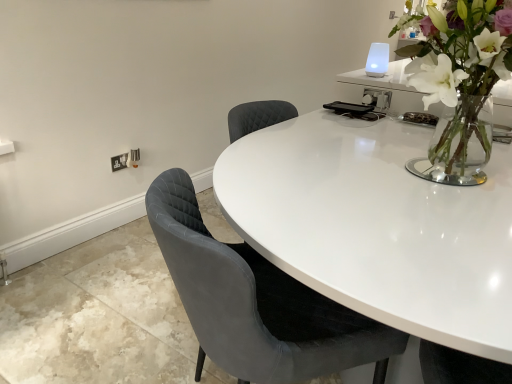
Question: Is white plastic electric outlet at lower left facing away from velvet grey chair at center?

Choices:
 (A) no
 (B) yes

Answer: (A)

Question: Is white plastic electric outlet at lower left at the left side of velvet grey chair at center?

Choices:
 (A) yes
 (B) no

Answer: (A)

Question: From the image's perspective, is white plastic electric outlet at lower left below velvet grey chair at center?

Choices:
 (A) yes
 (B) no

Answer: (B)

Question: Does white plastic electric outlet at lower left have a lesser height compared to velvet grey chair at center?

Choices:
 (A) yes
 (B) no

Answer: (A)

Question: From a real-world perspective, is white plastic electric outlet at lower left over velvet grey chair at center?

Choices:
 (A) yes
 (B) no

Answer: (B)

Question: Is white plastic electric outlet at lower left facing towards velvet grey chair at center?

Choices:
 (A) no
 (B) yes

Answer: (B)

Question: Can you see white plastic electric outlet at lower left touching clear glass vase at upper right?

Choices:
 (A) yes
 (B) no

Answer: (B)

Question: Can you confirm if white plastic electric outlet at lower left is bigger than clear glass vase at upper right?

Choices:
 (A) no
 (B) yes

Answer: (A)

Question: Is white plastic electric outlet at lower left facing away from clear glass vase at upper right?

Choices:
 (A) no
 (B) yes

Answer: (A)

Question: Does white plastic electric outlet at lower left lie behind clear glass vase at upper right?

Choices:
 (A) no
 (B) yes

Answer: (B)

Question: Is white plastic electric outlet at lower left to the left of clear glass vase at upper right from the viewer's perspective?

Choices:
 (A) yes
 (B) no

Answer: (A)

Question: From a real-world perspective, is white plastic electric outlet at lower left located higher than clear glass vase at upper right?

Choices:
 (A) no
 (B) yes

Answer: (A)

Question: Is velvet grey chair at center facing away from white plastic electric outlet at lower left?

Choices:
 (A) yes
 (B) no

Answer: (B)